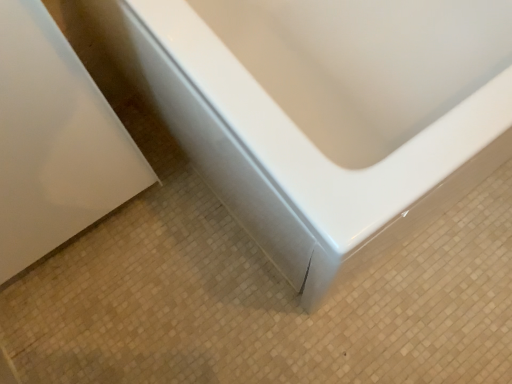
The image size is (512, 384). Find the location of `white glossy bathtub at center`. white glossy bathtub at center is located at coordinates (295, 147).

Describe the element at coordinates (295, 147) in the screenshot. I see `white glossy bathtub at center` at that location.

You are a GUI agent. You are given a task and a screenshot of the screen. Output one action in this format:
    pyautogui.click(x=<x>, y=<y>)
    Task: Click on the white glossy bathtub at center
    
    Given the screenshot: What is the action you would take?
    pyautogui.click(x=295, y=147)